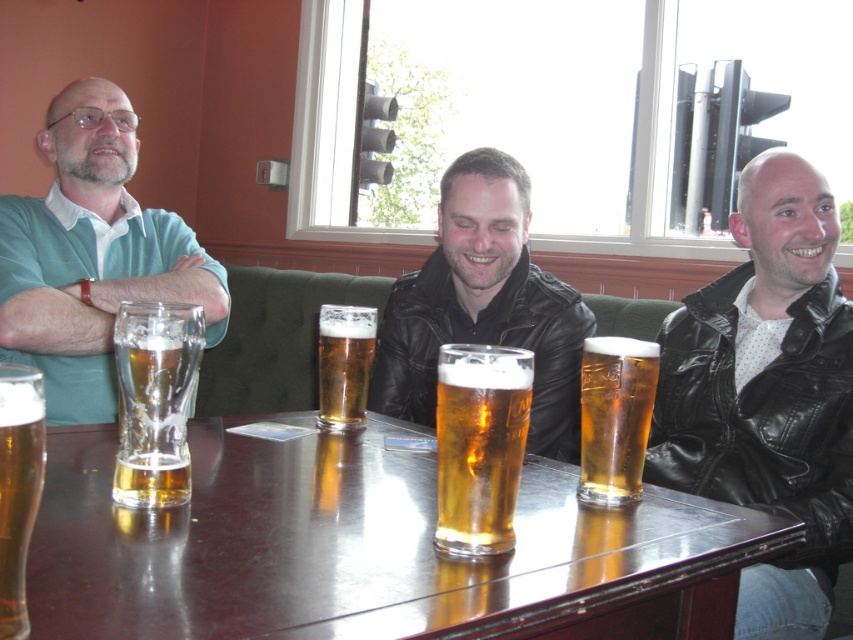
Measure the distance between translucent glass mug at lower left and translucent glass mug at center.

translucent glass mug at lower left is 30.13 inches from translucent glass mug at center.

Between translucent glass mug at lower left and translucent glass mug at center, which one has less height?

translucent glass mug at lower left is shorter.

Image resolution: width=853 pixels, height=640 pixels. What do you see at coordinates (18, 486) in the screenshot?
I see `translucent glass mug at lower left` at bounding box center [18, 486].

This screenshot has width=853, height=640. Find the location of `translucent glass mug at lower left`. translucent glass mug at lower left is located at coordinates (18, 486).

Between matte black leather jacket at center and golden glass at center, which one appears on the right side from the viewer's perspective?

Positioned to the right is matte black leather jacket at center.

Does matte black leather jacket at center appear on the right side of golden glass at center?

Indeed, matte black leather jacket at center is positioned on the right side of golden glass at center.

Who is more forward, (492,211) or (514,372)?

Point (514,372)

At what (x,y) coordinates should I click in order to perform the action: click on matte black leather jacket at center. Please return your answer as a coordinate pair (x, y). Looking at the image, I should click on (485, 305).

In the scene shown: Can you confirm if shiny dark wood table at center is positioned to the left of matte green polo shirt at left?

No, shiny dark wood table at center is not to the left of matte green polo shirt at left.

Which is more to the right, shiny dark wood table at center or matte green polo shirt at left?

Positioned to the right is shiny dark wood table at center.

What do you see at coordinates (368, 548) in the screenshot? The image size is (853, 640). I see `shiny dark wood table at center` at bounding box center [368, 548].

You are a GUI agent. You are given a task and a screenshot of the screen. Output one action in this format:
    pyautogui.click(x=<x>, y=<y>)
    Task: Click on the shiny dark wood table at center
    
    Given the screenshot: What is the action you would take?
    [x=368, y=548]